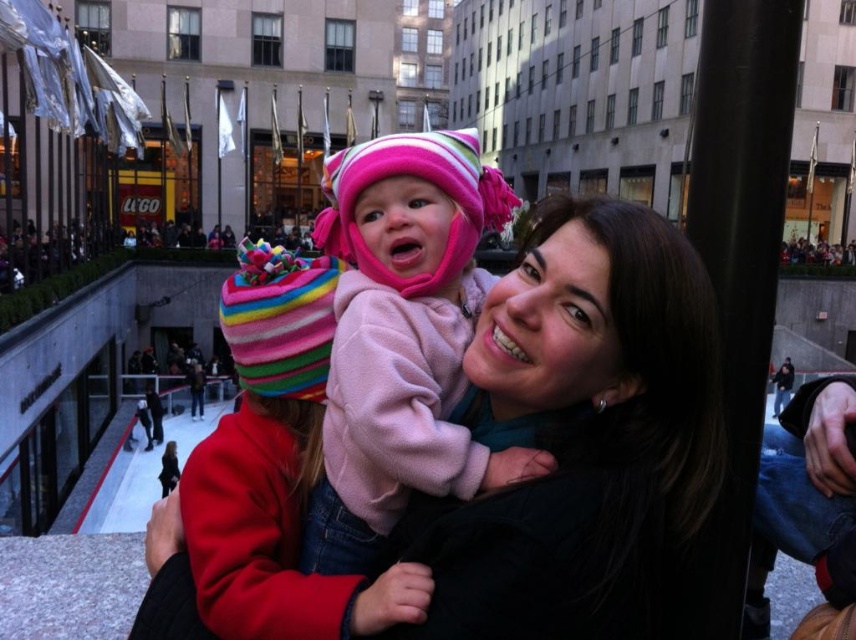
Question: Is matte black jacket at center bigger than pink fleece baby at center?

Choices:
 (A) no
 (B) yes

Answer: (B)

Question: In this image, where is matte black jacket at center located relative to pink fleece baby at center?

Choices:
 (A) right
 (B) left

Answer: (A)

Question: Which point appears closest to the camera in this image?

Choices:
 (A) (586, 362)
 (B) (330, 198)

Answer: (A)

Question: From the image, what is the correct spatial relationship of matte black jacket at center in relation to pink fleece baby at center?

Choices:
 (A) right
 (B) left

Answer: (A)